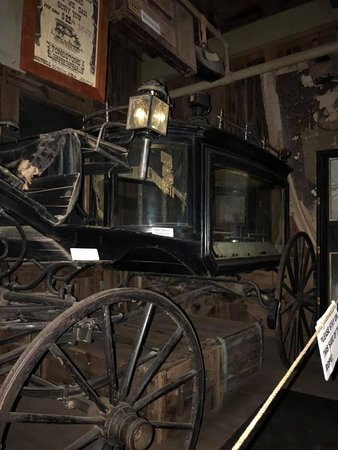
This screenshot has width=338, height=450. I want to click on seat, so click(x=50, y=195).